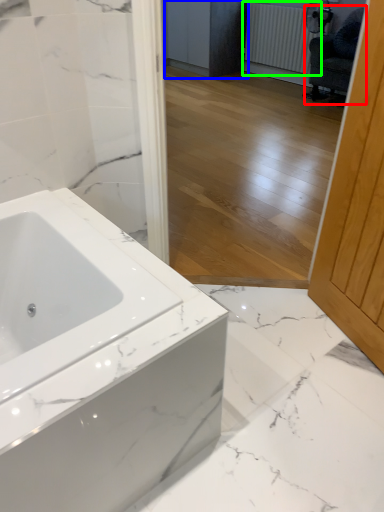
Question: Based on their relative distances, which object is nearer to swivel chair (highlighted by a red box)? Choose from cabinetry (highlighted by a blue box) and radiator (highlighted by a green box).

Choices:
 (A) cabinetry
 (B) radiator

Answer: (B)